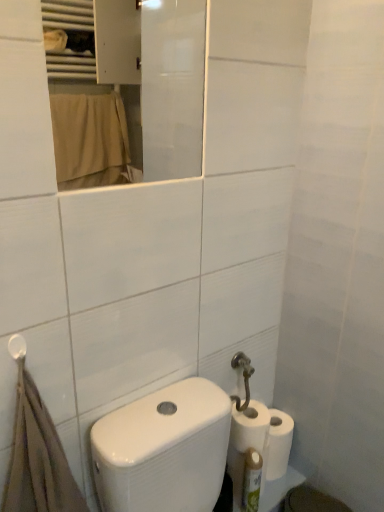
Question: Would you say white matte toilet paper at lower right, placed as the 1th toilet paper when sorted from bottom to top, is inside or outside white glossy mirror at upper center?

Choices:
 (A) inside
 (B) outside

Answer: (B)

Question: In the image, is white matte toilet paper at lower right, placed as the third toilet paper when sorted from top to bottom, on the left side or the right side of white glossy mirror at upper center?

Choices:
 (A) left
 (B) right

Answer: (B)

Question: Which object is positioned closest to the white matte toilet paper at lower right, which is counted as the second toilet paper, starting from the top?

Choices:
 (A) green plastic bottle at lower right
 (B) white glossy mirror at upper center
 (C) white glossy bidet at lower right
 (D) brown cotton bath towel at lower left
 (E) white matte toilet paper at lower right, the third toilet paper when ordered from bottom to top

Answer: (E)

Question: Which object is the farthest from the white glossy bidet at lower right?

Choices:
 (A) brown cotton bath towel at lower left
 (B) green plastic bottle at lower right
 (C) white matte toilet paper at lower right, the 2th toilet paper positioned from the bottom
 (D) white plastic towel bar at upper left
 (E) white matte toilet paper at lower right, placed as the 1th toilet paper when sorted from bottom to top

Answer: (D)